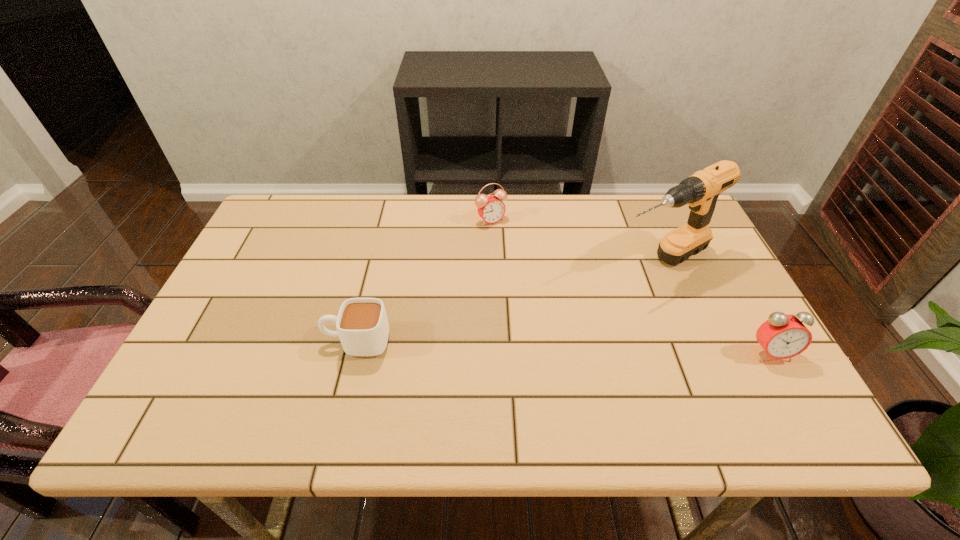
The image size is (960, 540). In order to click on drill present at the right edge in this screenshot , I will do `click(700, 192)`.

At what (x,y) coordinates should I click in order to perform the action: click on object located at the far right corner. Please return your answer as a coordinate pair (x, y). This screenshot has height=540, width=960. Looking at the image, I should click on click(700, 192).

The width and height of the screenshot is (960, 540). In order to click on object at the near right corner in this screenshot , I will do `click(782, 336)`.

Where is `vacant space at the far edge of the desktop`? vacant space at the far edge of the desktop is located at coordinates (549, 207).

Where is `vacant space at the near edge`? vacant space at the near edge is located at coordinates (476, 365).

This screenshot has width=960, height=540. Find the location of `blank area at the left edge`. blank area at the left edge is located at coordinates (284, 284).

Locate an element on the screen. This screenshot has width=960, height=540. vacant space at the right edge is located at coordinates (688, 302).

Where is `vacant space at the near left corner of the desktop`? This screenshot has width=960, height=540. vacant space at the near left corner of the desktop is located at coordinates (178, 371).

Identify the location of vacant region at the far right corner of the desktop. (673, 224).

Find the location of `free space at the near right corner of the desktop`. free space at the near right corner of the desktop is located at coordinates (780, 375).